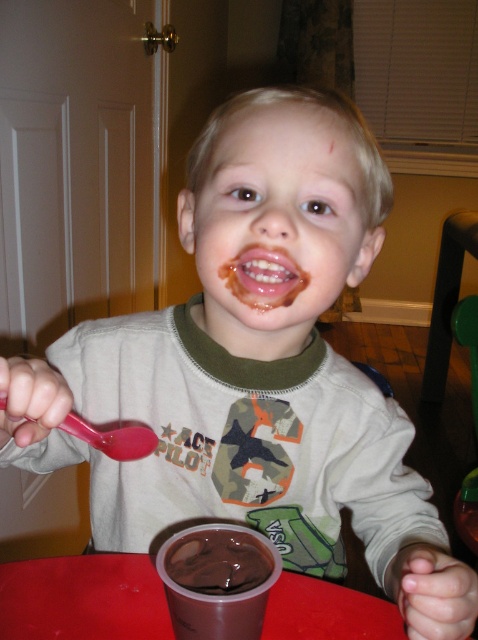
You are standing in the dining area and want to reach the point at coordinates (286, 113). If your arm can reach up to 40 centimeters, will you be able to touch that point?

The point at coordinates (286, 113) is 45.02 centimeters away from the viewer. Since your arm can only reach up to 40 centimeters, you cannot touch that point.